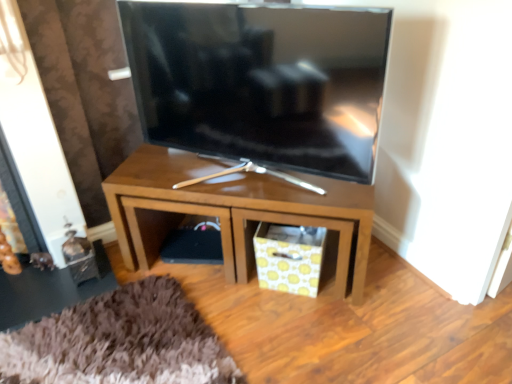
Where is `free spot to the right of shiny metallic side table at lower left`? free spot to the right of shiny metallic side table at lower left is located at coordinates pos(146,300).